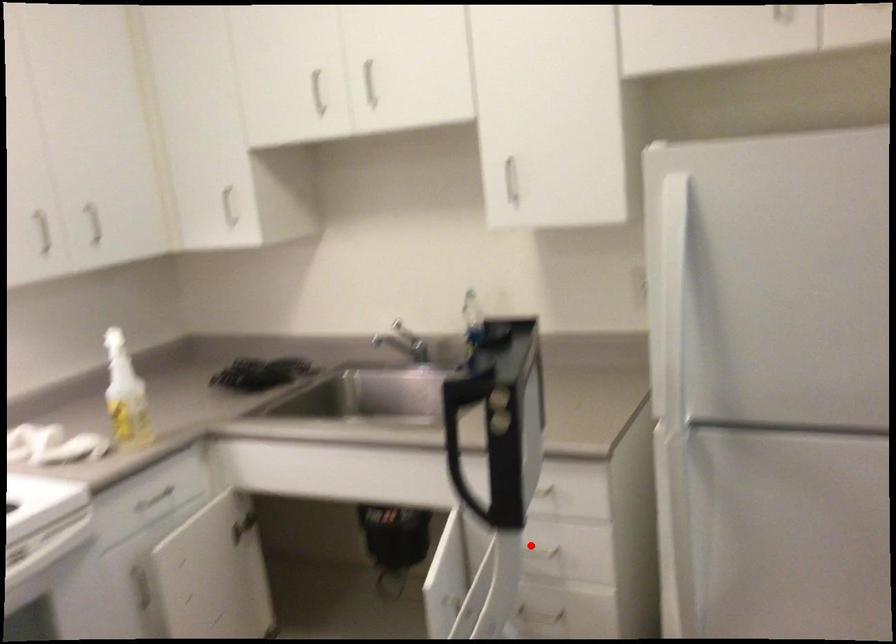
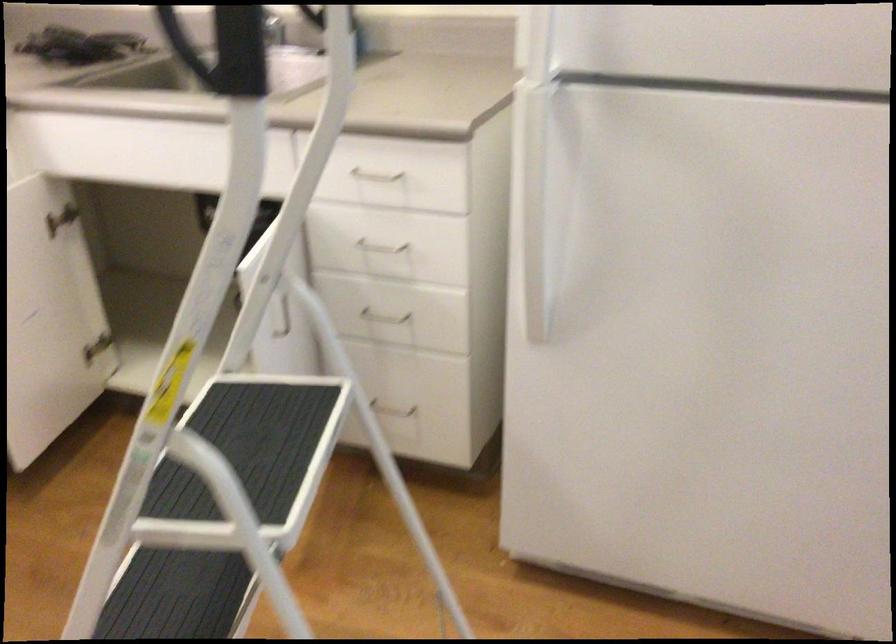
The point at the highlighted location is marked in the first image. Where is the corresponding point in the second image?

(380, 247)